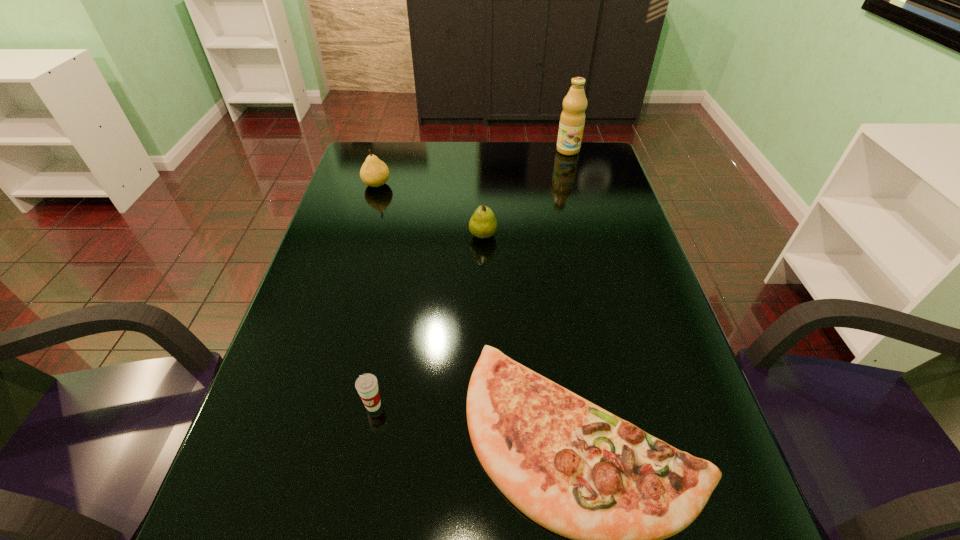
Where is `blank space located on the side of the cup with the logo`? blank space located on the side of the cup with the logo is located at coordinates (354, 510).

The image size is (960, 540). I want to click on olive oil present at the far edge, so click(x=572, y=119).

I want to click on pear that is at the far edge, so click(374, 172).

Image resolution: width=960 pixels, height=540 pixels. Identify the location of object that is at the left edge. (374, 172).

I want to click on object that is at the right edge, so click(572, 119).

Find the location of a particular element. Image resolution: width=960 pixels, height=540 pixels. object situated at the far left corner is located at coordinates (374, 172).

At what (x,y) coordinates should I click in order to perform the action: click on object present at the far right corner. Please return your answer as a coordinate pair (x, y). This screenshot has height=540, width=960. Looking at the image, I should click on (572, 119).

Locate an element on the screen. This screenshot has height=540, width=960. vacant space at the far edge of the desktop is located at coordinates (534, 163).

Image resolution: width=960 pixels, height=540 pixels. In the image, there is a desktop. What are the coordinates of `vacant space at the left edge` in the screenshot? It's located at (360, 272).

Locate an element on the screen. Image resolution: width=960 pixels, height=540 pixels. vacant area at the right edge of the desktop is located at coordinates (637, 279).